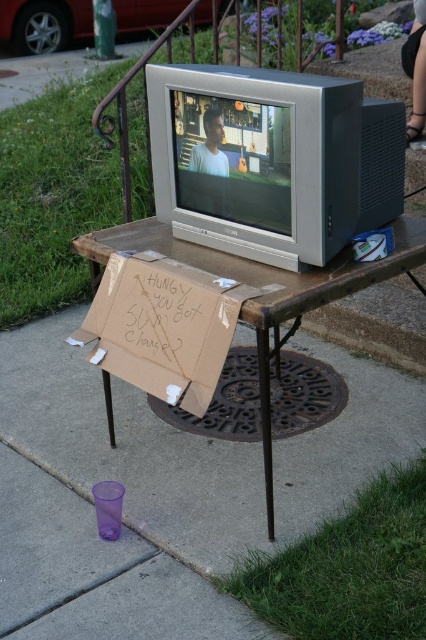
Is purple plastic cup at lower left wider than brown cardboard sign at center?

Yes.

The image size is (426, 640). What are the coordinates of `purple plastic cup at lower left` in the screenshot? It's located at (199, 448).